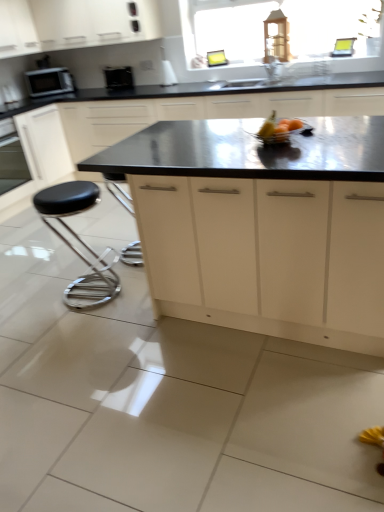
Question: Should I look upward or downward to see black leather stool at lower left?

Choices:
 (A) up
 (B) down

Answer: (A)

Question: Is metallic silver bowl at center wider than black glossy microwave at upper left?

Choices:
 (A) yes
 (B) no

Answer: (A)

Question: Does metallic silver bowl at center have a larger size compared to black glossy microwave at upper left?

Choices:
 (A) no
 (B) yes

Answer: (A)

Question: From the image's perspective, is metallic silver bowl at center over black glossy microwave at upper left?

Choices:
 (A) no
 (B) yes

Answer: (A)

Question: Does metallic silver bowl at center have a smaller size compared to black glossy microwave at upper left?

Choices:
 (A) yes
 (B) no

Answer: (A)

Question: From a real-world perspective, is metallic silver bowl at center below black glossy microwave at upper left?

Choices:
 (A) no
 (B) yes

Answer: (B)

Question: Considering the relative sizes of metallic silver bowl at center and black glossy microwave at upper left in the image provided, is metallic silver bowl at center shorter than black glossy microwave at upper left?

Choices:
 (A) yes
 (B) no

Answer: (A)

Question: From the image's perspective, is white matte cabinet at upper left, which is counted as the 3th cabinetry, starting from the bottom, below black leather stool at lower left?

Choices:
 (A) no
 (B) yes

Answer: (A)

Question: Considering the relative positions of white matte cabinet at upper left, acting as the second cabinetry starting from the top, and black leather stool at lower left in the image provided, is white matte cabinet at upper left, acting as the second cabinetry starting from the top, behind black leather stool at lower left?

Choices:
 (A) no
 (B) yes

Answer: (B)

Question: Is white matte cabinet at upper left, which is counted as the 3th cabinetry, starting from the bottom, smaller than black leather stool at lower left?

Choices:
 (A) yes
 (B) no

Answer: (B)

Question: Does white matte cabinet at upper left, which is counted as the 3th cabinetry, starting from the bottom, turn towards black leather stool at lower left?

Choices:
 (A) yes
 (B) no

Answer: (B)

Question: From a real-world perspective, is white matte cabinet at upper left, which is counted as the 3th cabinetry, starting from the bottom, below black leather stool at lower left?

Choices:
 (A) no
 (B) yes

Answer: (A)

Question: Does white matte cabinet at upper left, acting as the second cabinetry starting from the top, have a greater width compared to black leather stool at lower left?

Choices:
 (A) no
 (B) yes

Answer: (A)

Question: Is white matte cabinet at upper center, which is the 1th cabinetry from top to bottom, closer to the viewer compared to white matte cabinet at upper center, arranged as the 3th cabinetry when viewed from the top?

Choices:
 (A) yes
 (B) no

Answer: (B)